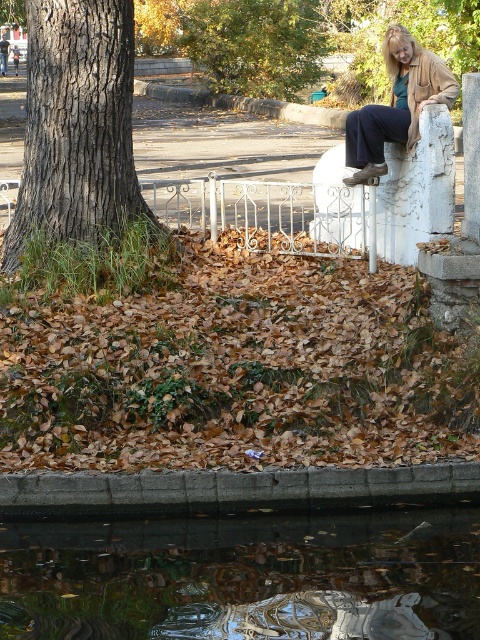
Question: Which point is closer to the camera?

Choices:
 (A) (70, 177)
 (B) (225, 12)
 (C) (361, 132)

Answer: (A)

Question: Is gray textured bark at left positioned in front of matte brown jacket at upper right?

Choices:
 (A) yes
 (B) no

Answer: (A)

Question: Is gray textured bark at left further to camera compared to green leafy tree at upper center?

Choices:
 (A) no
 (B) yes

Answer: (A)

Question: Which point appears closest to the camera in this image?

Choices:
 (A) (6, 497)
 (B) (216, 4)

Answer: (A)

Question: Which of the following is the farthest from the observer?

Choices:
 (A) (117, 154)
 (B) (404, 129)
 (C) (192, 582)

Answer: (A)

Question: Can you confirm if reflective glass water at lower center is thinner than concrete ledge at lower center?

Choices:
 (A) no
 (B) yes

Answer: (A)